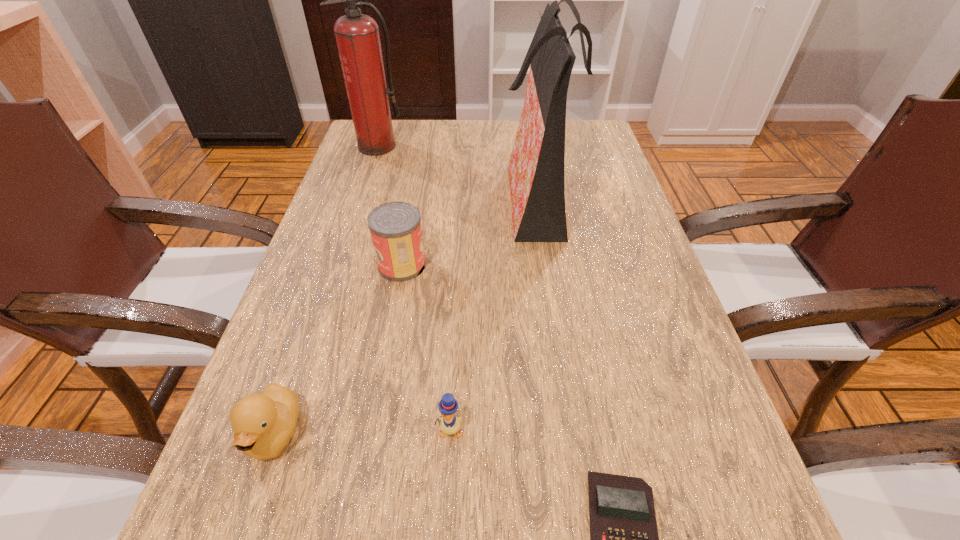
The width and height of the screenshot is (960, 540). What are the coordinates of `the second farthest object` in the screenshot? It's located at (536, 167).

Find the location of a particular element. The image size is (960, 540). fire extinguisher is located at coordinates (357, 35).

I want to click on the fourth object from right to left, so click(x=395, y=227).

Where is `the third tallest object`? the third tallest object is located at coordinates (395, 227).

You are a GUI agent. You are given a task and a screenshot of the screen. Output one action in this format:
    pyautogui.click(x=<x>, y=<y>)
    Task: Click on the taller duckling
    
    Given the screenshot: What is the action you would take?
    pyautogui.click(x=263, y=424)

Where is `the left duckling`? The image size is (960, 540). the left duckling is located at coordinates (263, 424).

At what (x,y) coordinates should I click in order to perform the action: click on the shorter duckling. Please return your answer as a coordinate pair (x, y). The image size is (960, 540). Looking at the image, I should click on (449, 424).

Find the location of a particular element. The image size is (960, 540). the right duckling is located at coordinates (449, 424).

Identify the location of free point located on the front side of the fifth nearest object. The height and width of the screenshot is (540, 960). (470, 195).

This screenshot has height=540, width=960. In order to click on free space located on the front side of the fifth nearest object in this screenshot , I will do click(x=410, y=195).